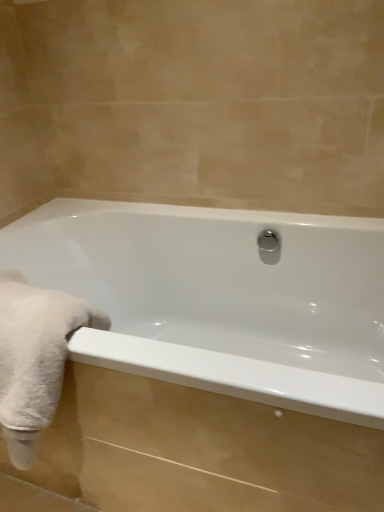
Question: From the image's perspective, would you say white fluffy towel at left is positioned over white glossy bathtub at center?

Choices:
 (A) yes
 (B) no

Answer: (A)

Question: Is white fluffy towel at left touching white glossy bathtub at center?

Choices:
 (A) yes
 (B) no

Answer: (B)

Question: Considering the relative sizes of white fluffy towel at left and white glossy bathtub at center in the image provided, is white fluffy towel at left wider than white glossy bathtub at center?

Choices:
 (A) no
 (B) yes

Answer: (A)

Question: From the image's perspective, is white fluffy towel at left beneath white glossy bathtub at center?

Choices:
 (A) yes
 (B) no

Answer: (B)

Question: Is the depth of white fluffy towel at left less than that of white glossy bathtub at center?

Choices:
 (A) yes
 (B) no

Answer: (B)

Question: Is polished chrome shower at center inside or outside of white fluffy towel at left?

Choices:
 (A) inside
 (B) outside

Answer: (B)

Question: In terms of width, does polished chrome shower at center look wider or thinner when compared to white fluffy towel at left?

Choices:
 (A) thin
 (B) wide

Answer: (A)

Question: In the image, is polished chrome shower at center positioned in front of or behind white fluffy towel at left?

Choices:
 (A) front
 (B) behind

Answer: (B)

Question: Considering the relative positions of polished chrome shower at center and white fluffy towel at left in the image provided, is polished chrome shower at center to the left or to the right of white fluffy towel at left?

Choices:
 (A) left
 (B) right

Answer: (B)

Question: In the image, is white glossy bathtub at center positioned in front of or behind white fluffy towel at left?

Choices:
 (A) front
 (B) behind

Answer: (A)

Question: From the image's perspective, is white glossy bathtub at center positioned above or below white fluffy towel at left?

Choices:
 (A) below
 (B) above

Answer: (A)

Question: Is white glossy bathtub at center wider or thinner than white fluffy towel at left?

Choices:
 (A) wide
 (B) thin

Answer: (A)

Question: Based on their positions, is white glossy bathtub at center located to the left or right of white fluffy towel at left?

Choices:
 (A) right
 (B) left

Answer: (A)

Question: From the image's perspective, relative to white glossy bathtub at center, is polished chrome shower at center above or below?

Choices:
 (A) above
 (B) below

Answer: (A)

Question: Is polished chrome shower at center spatially inside white glossy bathtub at center, or outside of it?

Choices:
 (A) inside
 (B) outside

Answer: (A)